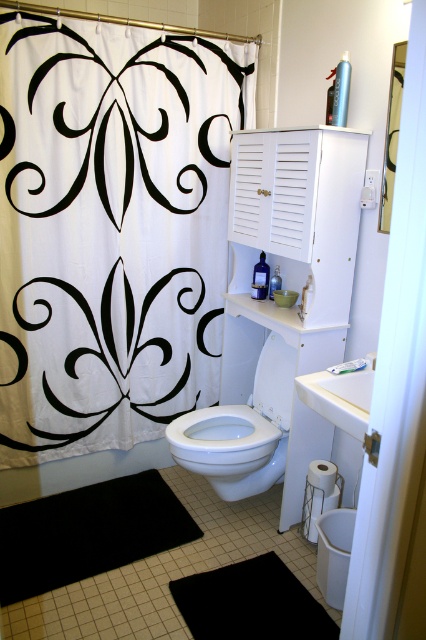
How much distance is there between black fabric at center and white glossy toilet bowl at center?

black fabric at center and white glossy toilet bowl at center are 20.84 inches apart from each other.

Between black fabric at center and white glossy toilet bowl at center, which one appears on the left side from the viewer's perspective?

From the viewer's perspective, black fabric at center appears more on the left side.

Identify the location of black fabric at center. (106, 353).

Does white glossy toilet bowl at center have a greater height compared to white glossy sink at upper right?

Yes.

What do you see at coordinates (241, 429) in the screenshot? I see `white glossy toilet bowl at center` at bounding box center [241, 429].

Which is behind, point (261, 410) or point (344, 394)?

Positioned behind is point (261, 410).

At what (x,y) coordinates should I click in order to perform the action: click on white glossy toilet bowl at center. Please return your answer as a coordinate pair (x, y). Looking at the image, I should click on (241, 429).

This screenshot has height=640, width=426. Find the location of `white fabric shower curtain at upper left`. white fabric shower curtain at upper left is located at coordinates (111, 228).

Based on the photo, can you confirm if white fabric shower curtain at upper left is positioned to the right of white glossy toilet bowl at center?

No, white fabric shower curtain at upper left is not to the right of white glossy toilet bowl at center.

Which is behind, point (89, 300) or point (207, 472)?

Point (89, 300)

You are a GUI agent. You are given a task and a screenshot of the screen. Output one action in this format:
    pyautogui.click(x=<x>, y=<y>)
    Task: Click on the white fabric shower curtain at upper left
    Image resolution: width=426 pixels, height=640 pixels.
    Given the screenshot: What is the action you would take?
    pyautogui.click(x=111, y=228)